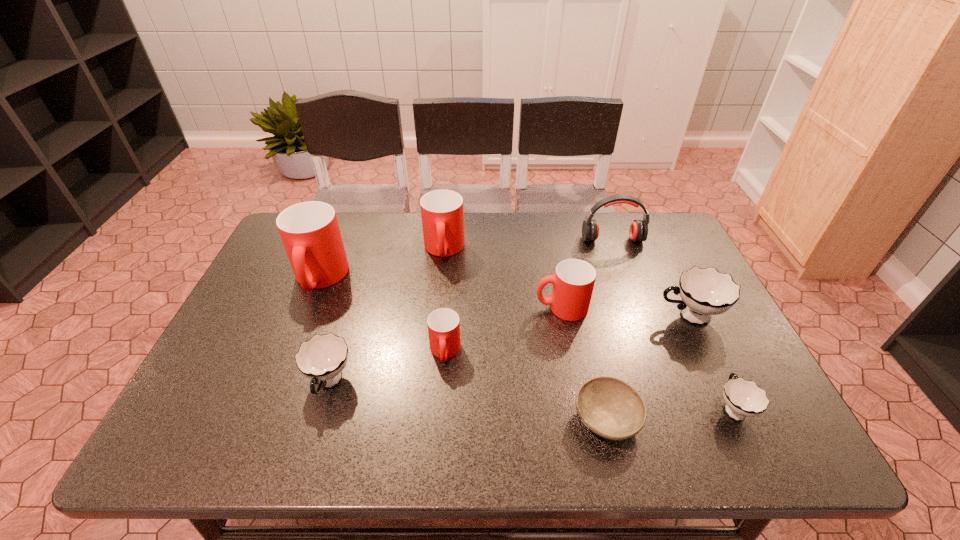
Image resolution: width=960 pixels, height=540 pixels. What are the coordinates of `free spot located on the side of the farthest white cup with the handle` in the screenshot? It's located at (546, 316).

The width and height of the screenshot is (960, 540). I want to click on vacant region located on the side of the farthest white cup with the handle, so click(550, 316).

Locate an element on the screen. blank space located 0.110m on the side of the nearest red cup with the handle is located at coordinates (441, 411).

I want to click on vacant space situated on the side of the leftmost white cup with the handle, so click(x=312, y=441).

Identify the location of vacant space situated on the side of the smallest white cup with the handle. (671, 279).

Where is `vacant space located on the side of the smallest white cup with the handle`? vacant space located on the side of the smallest white cup with the handle is located at coordinates (677, 291).

The width and height of the screenshot is (960, 540). I want to click on vacant area located 0.340m on the side of the smallest white cup with the handle, so click(x=674, y=286).

The width and height of the screenshot is (960, 540). I want to click on free region located 0.230m on the back of the gray bowl, so 583,316.

I want to click on earphone at the far edge, so click(x=638, y=231).

In order to click on cup at the near edge in this screenshot , I will do `click(743, 398)`.